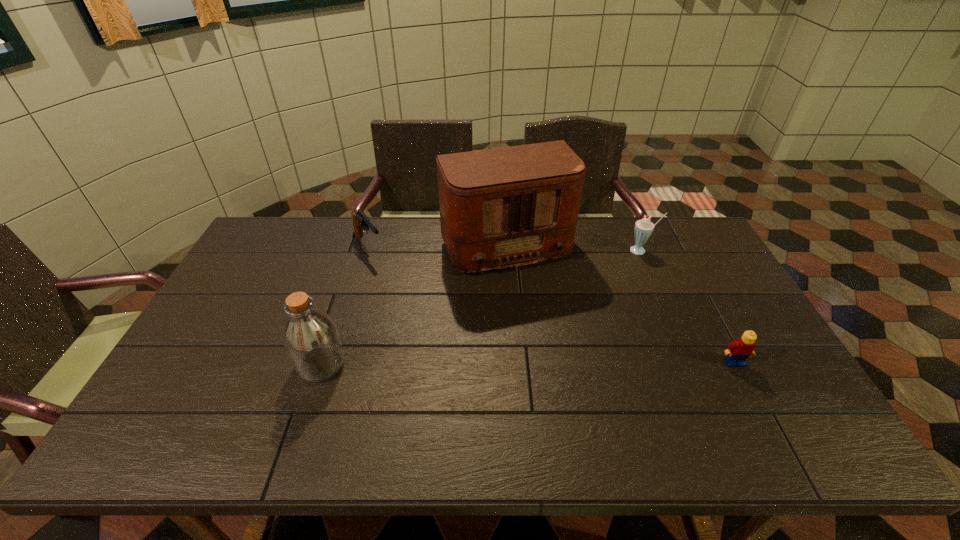
The width and height of the screenshot is (960, 540). Find the location of `bottle`. bottle is located at coordinates (310, 337).

Where is `Lego`? Lego is located at coordinates (738, 351).

At what (x,y) coordinates should I click in order to perform the action: click on radio receiver. Please return your answer as a coordinate pair (x, y). Image resolution: width=960 pixels, height=540 pixels. Looking at the image, I should click on (505, 207).

Where is `the tallest object`? The width and height of the screenshot is (960, 540). the tallest object is located at coordinates (505, 207).

Identify the location of gun. (360, 221).

Identify the location of the third tallest object. The width and height of the screenshot is (960, 540). (643, 228).

In order to click on milkshake in this screenshot , I will do `click(643, 228)`.

Image resolution: width=960 pixels, height=540 pixels. In order to click on free space located on the left of the bottle in this screenshot , I will do `click(277, 364)`.

Where is `vacant space located 0.050m on the front-facing side of the rightmost object`? The height and width of the screenshot is (540, 960). vacant space located 0.050m on the front-facing side of the rightmost object is located at coordinates (745, 383).

The width and height of the screenshot is (960, 540). What are the coordinates of `free space located 0.320m on the front panel of the radio receiver` in the screenshot? It's located at (563, 358).